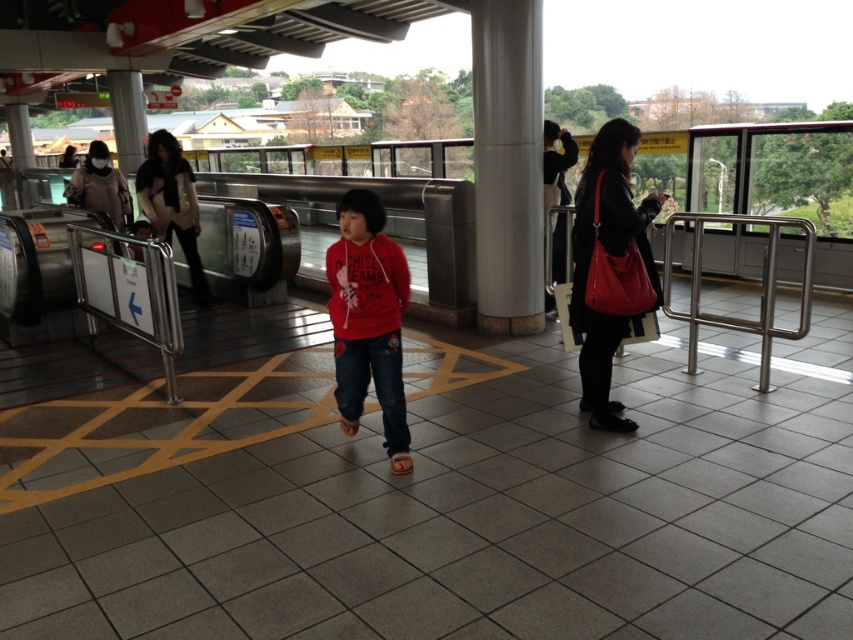
Between matte black handbag at center right and matte red hoodie at center, which one is positioned higher?

matte black handbag at center right is above.

Based on the photo, between matte black handbag at center right and matte red hoodie at center, which one is positioned lower?

matte red hoodie at center

Who is more forward, (x=595, y=307) or (x=367, y=266)?

Point (x=367, y=266) is more forward.

Find the location of a particular element. Image resolution: width=853 pixels, height=640 pixels. matte black handbag at center right is located at coordinates 608,266.

Is matte red hoodie at center wider than white fur coat at left?

In fact, matte red hoodie at center might be narrower than white fur coat at left.

Is point (370, 220) positioned in front of point (172, 225)?

That is True.

Where is `matte red hoodie at center`? This screenshot has width=853, height=640. matte red hoodie at center is located at coordinates (368, 320).

Is matte black handbag at center right smaller than matte black jacket at upper left?

Indeed, matte black handbag at center right has a smaller size compared to matte black jacket at upper left.

Does matte black handbag at center right appear under matte black jacket at upper left?

Yes.

Measure the distance between matte black handbag at center right and camera.

matte black handbag at center right is 12.93 feet away from camera.

Locate an element on the screen. The image size is (853, 640). matte black handbag at center right is located at coordinates (608, 266).